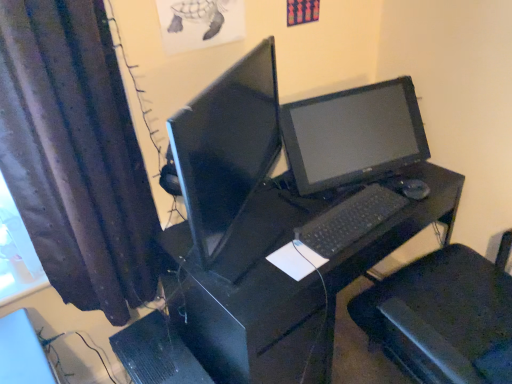
Question: Does matte black monitor at center appear on the left side of black plastic desk at center?

Choices:
 (A) no
 (B) yes

Answer: (B)

Question: Considering the relative positions of matte black monitor at center and black plastic desk at center in the image provided, is matte black monitor at center to the right of black plastic desk at center from the viewer's perspective?

Choices:
 (A) no
 (B) yes

Answer: (A)

Question: Can black plastic desk at center be found inside matte black monitor at center?

Choices:
 (A) no
 (B) yes

Answer: (A)

Question: Considering the relative sizes of matte black monitor at center and black plastic desk at center in the image provided, is matte black monitor at center wider than black plastic desk at center?

Choices:
 (A) yes
 (B) no

Answer: (B)

Question: Is matte black monitor at center shorter than black plastic desk at center?

Choices:
 (A) no
 (B) yes

Answer: (B)

Question: Based on their sizes in the image, would you say white paper at center is bigger or smaller than dark fabric curtain at left?

Choices:
 (A) big
 (B) small

Answer: (B)

Question: Is point (315, 263) positioned closer to the camera than point (35, 203)?

Choices:
 (A) closer
 (B) farther

Answer: (B)

Question: Is white paper at center in front of or behind dark fabric curtain at left in the image?

Choices:
 (A) behind
 (B) front

Answer: (A)

Question: Considering the positions of white paper at center and dark fabric curtain at left in the image, is white paper at center wider or thinner than dark fabric curtain at left?

Choices:
 (A) thin
 (B) wide

Answer: (A)

Question: Considering the positions of white paper at center and matte black monitor at center in the image, is white paper at center taller or shorter than matte black monitor at center?

Choices:
 (A) tall
 (B) short

Answer: (B)

Question: Is white paper at center bigger or smaller than matte black monitor at center?

Choices:
 (A) big
 (B) small

Answer: (B)

Question: Is white paper at center inside the boundaries of matte black monitor at center, or outside?

Choices:
 (A) inside
 (B) outside

Answer: (B)

Question: Considering their positions, is white paper at center located in front of or behind matte black monitor at center?

Choices:
 (A) behind
 (B) front

Answer: (A)

Question: From a real-world perspective, is dark fabric curtain at left physically located above or below black plastic mouse at right?

Choices:
 (A) below
 (B) above

Answer: (B)

Question: Considering the positions of dark fabric curtain at left and black plastic mouse at right in the image, is dark fabric curtain at left bigger or smaller than black plastic mouse at right?

Choices:
 (A) small
 (B) big

Answer: (B)